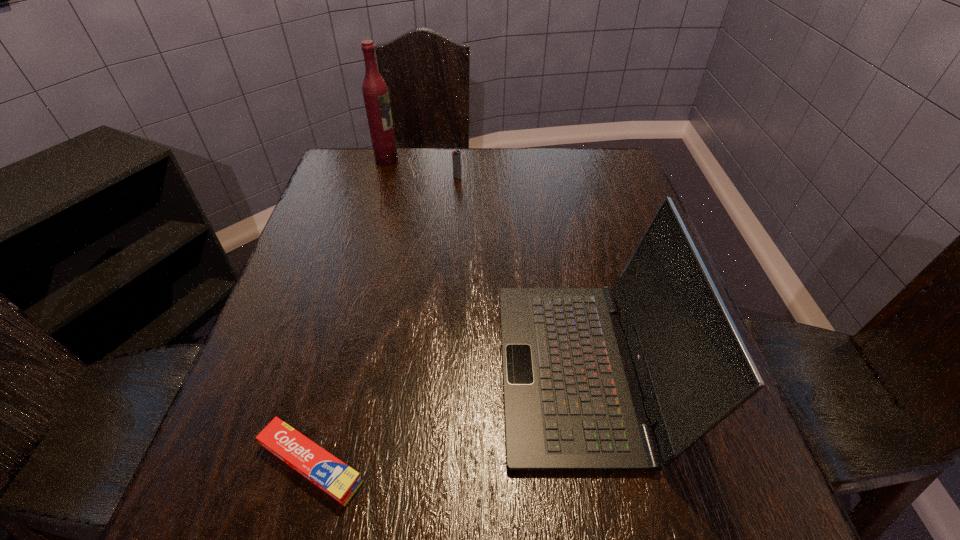
Locate an element on the screen. object at the far left corner is located at coordinates 375,92.

Find the location of a particular element. This screenshot has width=960, height=540. object positioned at the near left corner is located at coordinates (337, 479).

This screenshot has width=960, height=540. In order to click on object that is positioned at the near right corner in this screenshot , I will do `click(572, 402)`.

The height and width of the screenshot is (540, 960). I want to click on blank space at the far edge, so click(543, 152).

Where is `vacant space at the left edge`? This screenshot has width=960, height=540. vacant space at the left edge is located at coordinates (336, 379).

Where is `vacant space at the right edge of the desktop`? The image size is (960, 540). vacant space at the right edge of the desktop is located at coordinates (591, 247).

Image resolution: width=960 pixels, height=540 pixels. In the image, there is a desktop. Find the location of `blank space at the far left corner`. blank space at the far left corner is located at coordinates (358, 150).

The width and height of the screenshot is (960, 540). In order to click on free space at the far right corner of the desktop in this screenshot , I will do `click(618, 167)`.

This screenshot has width=960, height=540. Identify the location of vacant space at the near right corner of the desktop. 692,472.

In order to click on free space between the laptop computer and the liquor in this screenshot , I will do `click(484, 265)`.